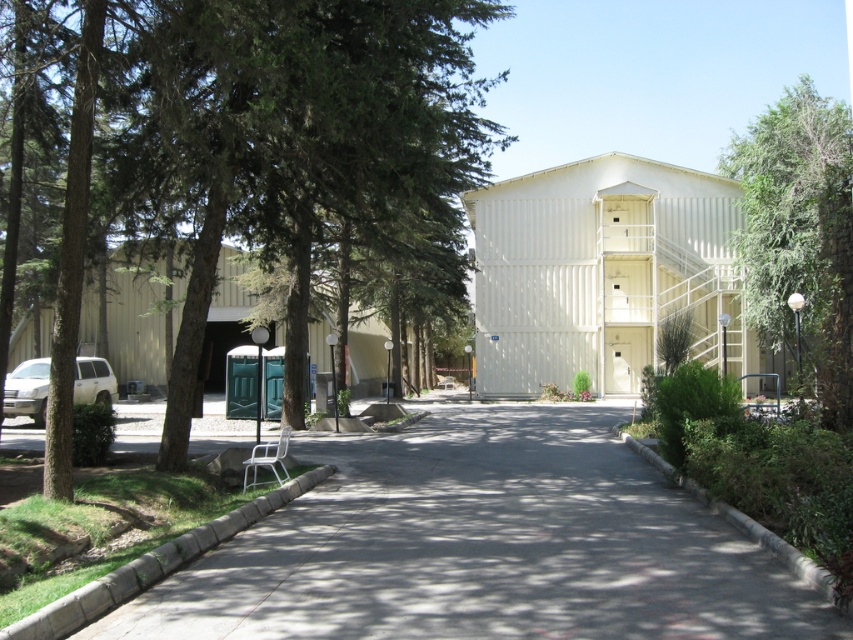
Question: Where is gray asphalt pavement at center located in relation to green leafy tree at upper right in the image?

Choices:
 (A) right
 (B) left

Answer: (B)

Question: In this image, where is green leafy tree at center located relative to green leafy tree at upper right?

Choices:
 (A) below
 (B) above

Answer: (B)

Question: Does green leafy tree at center appear over green leafy tree at upper right?

Choices:
 (A) no
 (B) yes

Answer: (B)

Question: Which point is farther to the camera?

Choices:
 (A) (799, 358)
 (B) (260, 45)
 (C) (519, 564)
 (D) (44, 385)

Answer: (A)

Question: Which point is farther to the camera?

Choices:
 (A) (33, 378)
 (B) (747, 586)

Answer: (A)

Question: Which object appears closest to the camera in this image?

Choices:
 (A) gray asphalt pavement at center
 (B) green leafy tree at center

Answer: (A)